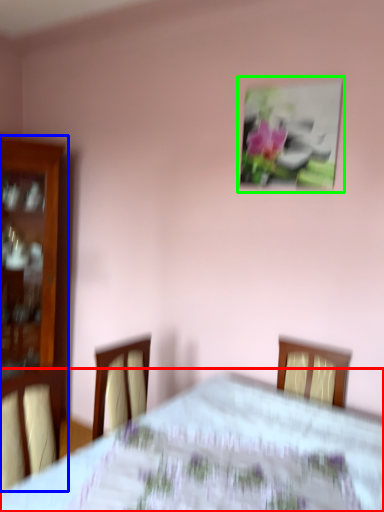
Question: Estimate the real-world distances between objects in this image. Which object is closer to bed (highlighted by a red box), furniture (highlighted by a blue box) or picture frame (highlighted by a green box)?

Choices:
 (A) furniture
 (B) picture frame

Answer: (B)